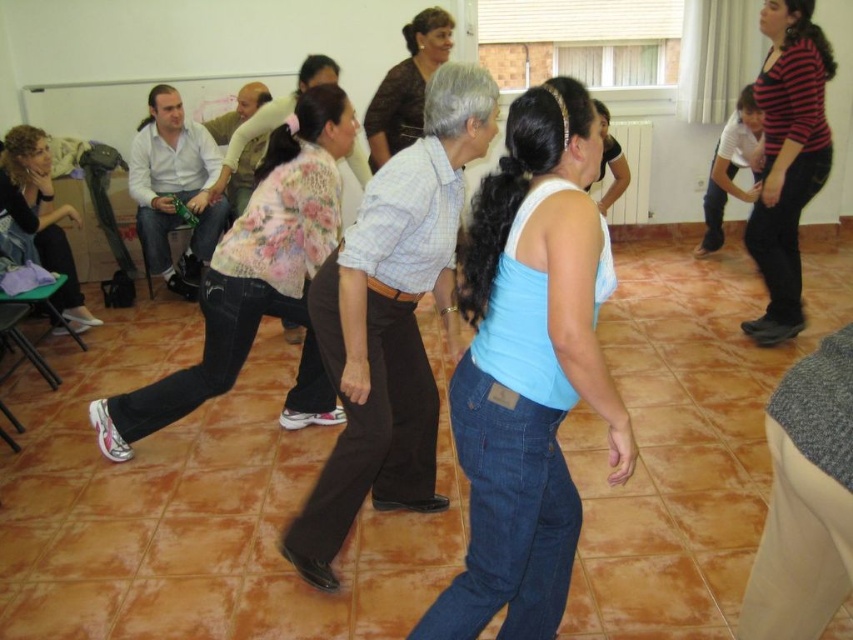
You are a photographer setting up a camera at the back of the room. You need to ensure both the light blue denim jeans at center and the striped cotton shirt at upper right are fully visible in your shot. Based on their positions and sizes, which object might require you to adjust your camera angle to avoid being partially blocked?

The light blue denim jeans at center has a lesser height compared to the striped cotton shirt at upper right, so the striped cotton shirt at upper right might be blocking part of the light blue denim jeans at center if not adjusted properly.